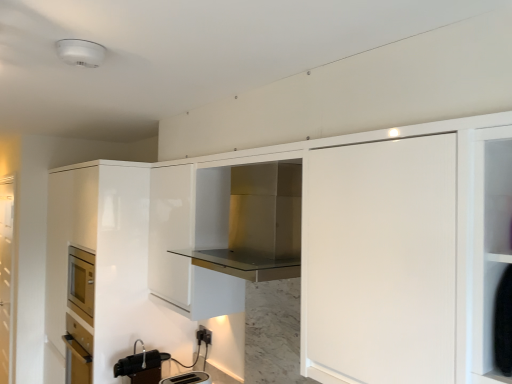
Question: Is glossy white cabinet at left, acting as the 2th cabinetry starting from the right, at the back of metallic silver faucet at lower center, placed as the 1th appliance when sorted from left to right?

Choices:
 (A) no
 (B) yes

Answer: (A)

Question: Can you confirm if metallic silver faucet at lower center, marked as the 2th appliance in a right-to-left arrangement, is taller than glossy white cabinet at left, the 2th cabinetry positioned from the front?

Choices:
 (A) no
 (B) yes

Answer: (A)

Question: Is metallic silver faucet at lower center, placed as the 1th appliance when sorted from left to right, closer to camera compared to glossy white cabinet at left, the 2th cabinetry positioned from the front?

Choices:
 (A) yes
 (B) no

Answer: (A)

Question: Does metallic silver faucet at lower center, placed as the 1th appliance when sorted from left to right, have a greater width compared to glossy white cabinet at left, positioned as the 1th cabinetry in left-to-right order?

Choices:
 (A) no
 (B) yes

Answer: (A)

Question: Does metallic silver faucet at lower center, marked as the 2th appliance in a right-to-left arrangement, contain glossy white cabinet at left, the 2th cabinetry positioned from the front?

Choices:
 (A) no
 (B) yes

Answer: (A)

Question: From their relative heights in the image, would you say glossy white cabinet at left, positioned as the 1th cabinetry in left-to-right order, is taller or shorter than stainless steel range hood at center, the first cabinetry when ordered from right to left?

Choices:
 (A) short
 (B) tall

Answer: (B)

Question: From the image's perspective, is glossy white cabinet at left, the 2th cabinetry positioned from the front, positioned above or below stainless steel range hood at center, marked as the 2th cabinetry in a left-to-right arrangement?

Choices:
 (A) above
 (B) below

Answer: (B)

Question: From a real-world perspective, is glossy white cabinet at left, positioned as the 1th cabinetry in left-to-right order, positioned above or below stainless steel range hood at center, the 2th cabinetry viewed from the back?

Choices:
 (A) below
 (B) above

Answer: (A)

Question: Considering the relative positions of glossy white cabinet at left, positioned as the 1th cabinetry in left-to-right order, and stainless steel range hood at center, which is the first cabinetry in front-to-back order, in the image provided, is glossy white cabinet at left, positioned as the 1th cabinetry in left-to-right order, to the left or to the right of stainless steel range hood at center, which is the first cabinetry in front-to-back order,?

Choices:
 (A) left
 (B) right

Answer: (A)

Question: Is stainless steel range hood at center, the 2th cabinetry viewed from the back, in front of or behind black plastic electric outlet at lower center in the image?

Choices:
 (A) behind
 (B) front

Answer: (B)

Question: Is stainless steel range hood at center, which is the first cabinetry in front-to-back order, to the left or to the right of black plastic electric outlet at lower center in the image?

Choices:
 (A) right
 (B) left

Answer: (A)

Question: Is point (257, 276) closer or farther from the camera than point (203, 339)?

Choices:
 (A) farther
 (B) closer

Answer: (B)

Question: From a real-world perspective, relative to black plastic electric outlet at lower center, is stainless steel range hood at center, the 2th cabinetry viewed from the back, vertically above or below?

Choices:
 (A) below
 (B) above

Answer: (B)

Question: Based on their positions, is black plastic electric outlet at lower center located to the left or right of glossy white cabinet at left, acting as the 2th cabinetry starting from the right?

Choices:
 (A) right
 (B) left

Answer: (A)

Question: In terms of width, does black plastic electric outlet at lower center look wider or thinner when compared to glossy white cabinet at left, the 2th cabinetry positioned from the front?

Choices:
 (A) wide
 (B) thin

Answer: (B)